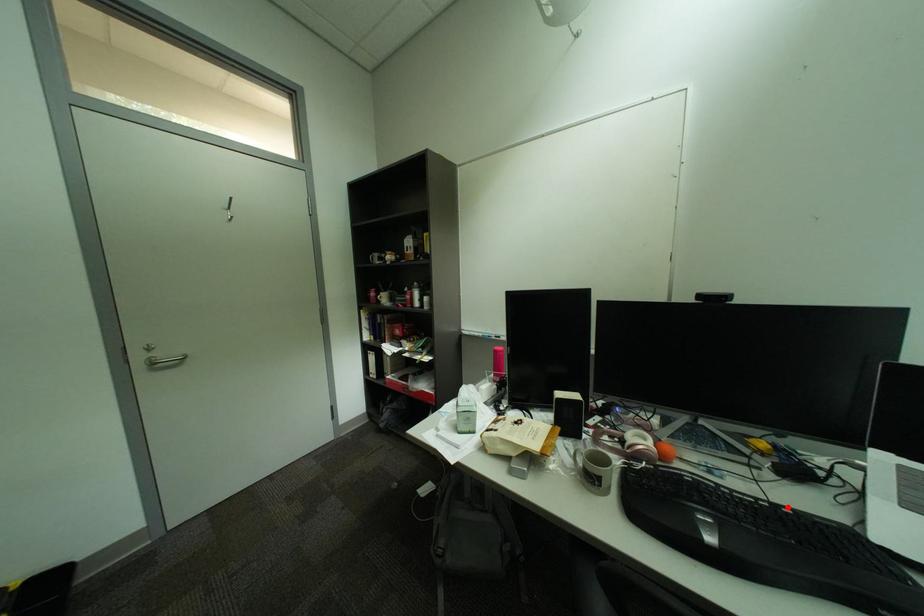
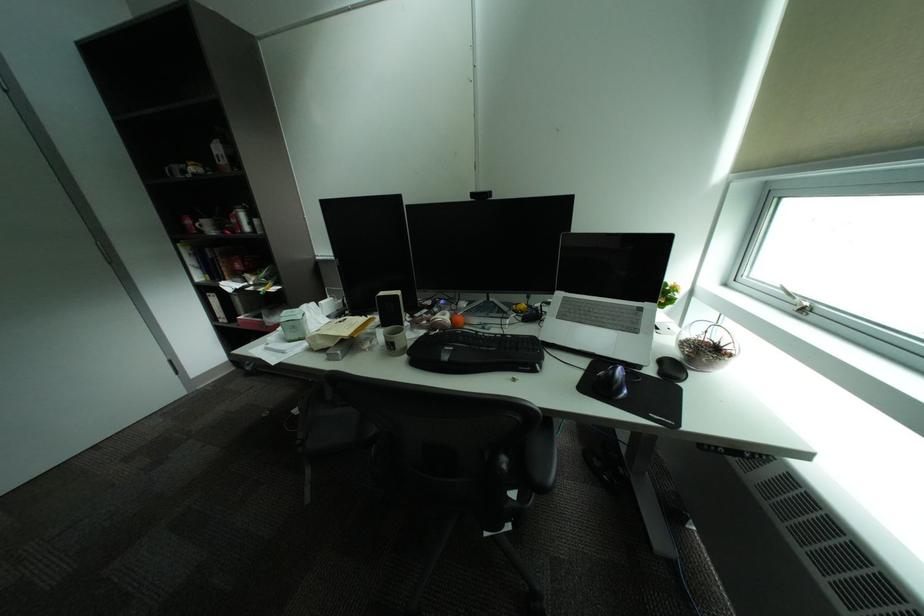
Question: I am providing you with two images of the same scene from different viewpoints. A red point is marked on the first image. Is the red point's position out of view in image 2?

Choices:
 (A) Yes
 (B) No

Answer: (B)